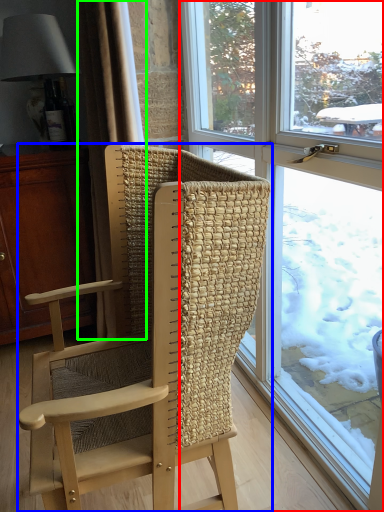
Question: Estimate the real-world distances between objects in this image. Which object is farther from window (highlighted by a red box), chair (highlighted by a blue box) or curtain (highlighted by a green box)?

Choices:
 (A) chair
 (B) curtain

Answer: (B)